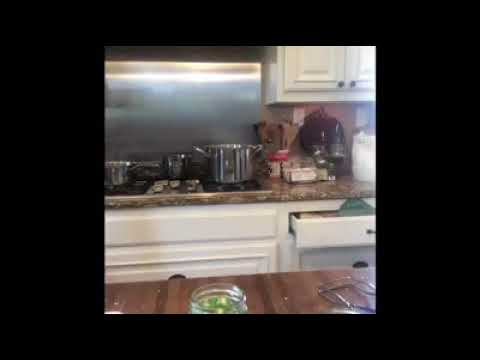
What are the coordinates of `cupboard` in the screenshot? It's located at (313, 75).